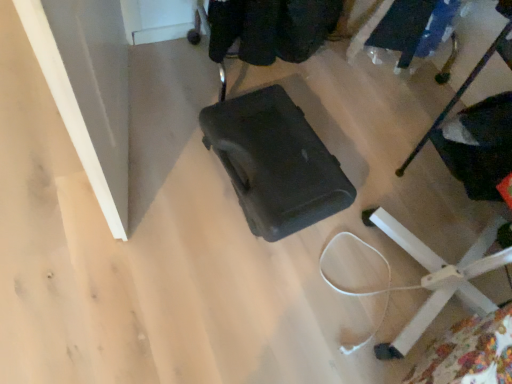
You are a GUI agent. You are given a task and a screenshot of the screen. Output one action in this format:
    pyautogui.click(x=<x>, y=<y>)
    Task: Click on the vacant location below white plastic chair at lower right (from a real-world perspective)
    The image size is (512, 384).
    Given the screenshot: What is the action you would take?
    pyautogui.click(x=462, y=210)